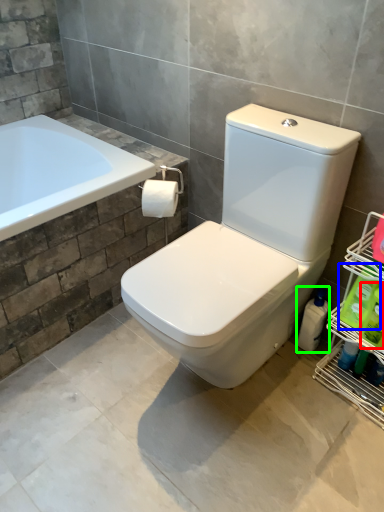
Question: Based on their relative distances, which object is farther from cleaning product (highlighted by a red box)? Choose from cleaning product (highlighted by a blue box) and cleaning product (highlighted by a green box).

Choices:
 (A) cleaning product
 (B) cleaning product

Answer: (B)